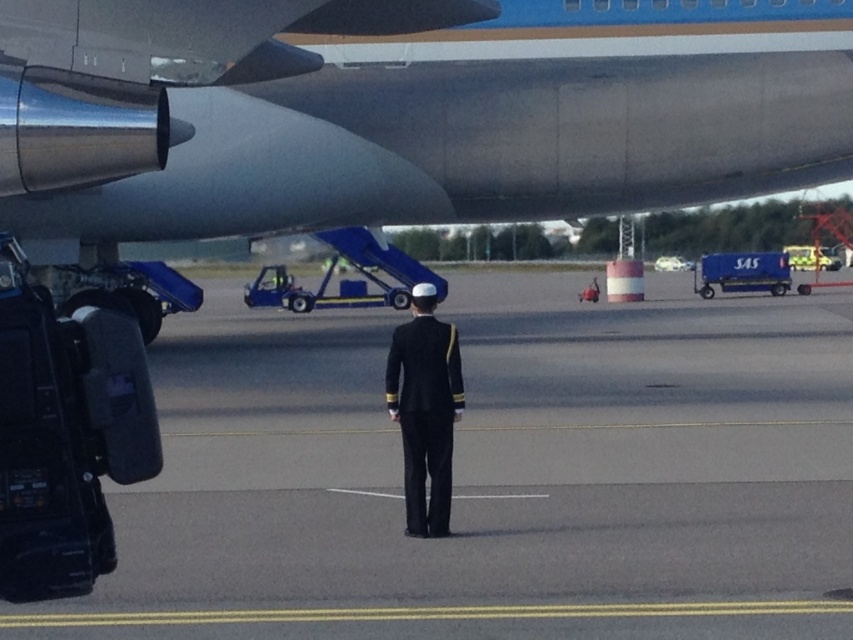
You are a photographer positioned at the airport tarmac. You want to take a photo that includes both the metallic gray airplane at upper center and the navy blue uniform at center. Which object should you adjust your camera focus on first to ensure both are in frame?

The metallic gray airplane at upper center is closer to the viewer than the navy blue uniform at center. To ensure both are in frame, adjust the camera focus starting with the metallic gray airplane at upper center since it is nearer, then adjust to include the navy blue uniform at center.

Consider the image. You are a photographer positioned at the airport tarmac. You need to capture a photo that includes both the metallic gray airplane at upper center and the navy blue uniform at center. Given their sizes, which object should you frame closer to the center of the photo to ensure both fit in the frame?

Since the metallic gray airplane at upper center is wider than the navy blue uniform at center, you should frame the metallic gray airplane at upper center closer to the center of the photo to ensure both fit in the frame.

Looking at this image, you are a photographer trying to capture a photo of the metallic gray airplane at upper center and the navy blue uniform at center. Which object should you zoom in on to ensure both are clearly visible in the frame?

Since the metallic gray airplane at upper center is bigger than the navy blue uniform at center, you should zoom in on the navy blue uniform at center so that both objects fit well within the camera frame.